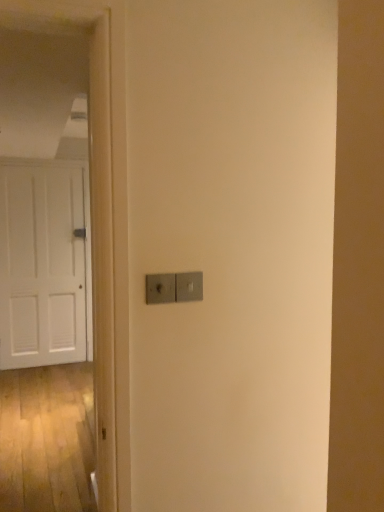
Find the location of a particular element. This screenshot has width=384, height=512. white matte door at left is located at coordinates (42, 265).

Do you think satin silver switch at center, which ranks as the first light switch in left-to-right order, is within satin silver switch at center, which appears as the first light switch when viewed from the right, or outside of it?

satin silver switch at center, which ranks as the first light switch in left-to-right order, is spatially situated outside satin silver switch at center, which appears as the first light switch when viewed from the right.

Is satin silver switch at center, the 2th light switch from the right, aimed at satin silver switch at center, which appears as the first light switch when viewed from the right?

No, satin silver switch at center, the 2th light switch from the right, does not turn towards satin silver switch at center, which appears as the first light switch when viewed from the right.

The image size is (384, 512). Find the location of `light switch on the right of satin silver switch at center, which ranks as the first light switch in left-to-right order`. light switch on the right of satin silver switch at center, which ranks as the first light switch in left-to-right order is located at coordinates (189, 286).

Is satin silver switch at center, the 2th light switch from the right, further to the viewer compared to satin silver switch at center, which is counted as the 2th light switch, starting from the left?

No, the depth of satin silver switch at center, the 2th light switch from the right, is less than that of satin silver switch at center, which is counted as the 2th light switch, starting from the left.

Is satin silver switch at center, which appears as the first light switch when viewed from the right, located within white matte door at left?

No, satin silver switch at center, which appears as the first light switch when viewed from the right, is not a part of white matte door at left.

Are white matte door at left and satin silver switch at center, which is counted as the 2th light switch, starting from the left, making contact?

white matte door at left is not next to satin silver switch at center, which is counted as the 2th light switch, starting from the left, and they're not touching.

Which of these two, white matte door at left or satin silver switch at center, which appears as the first light switch when viewed from the right, is wider?

white matte door at left.

Considering the sizes of objects white matte door at left and satin silver switch at center, which is counted as the 2th light switch, starting from the left, in the image provided, who is shorter, white matte door at left or satin silver switch at center, which is counted as the 2th light switch, starting from the left,?

Standing shorter between the two is satin silver switch at center, which is counted as the 2th light switch, starting from the left.

This screenshot has width=384, height=512. I want to click on door below the satin silver switch at center, which is counted as the 2th light switch, starting from the left (from the image's perspective), so click(42, 265).

Which is closer to the camera, (196, 300) or (77, 174)?

Point (196, 300) is positioned closer to the camera compared to point (77, 174).

Which object is positioned more to the left, satin silver switch at center, which appears as the first light switch when viewed from the right, or white matte door at left?

From the viewer's perspective, white matte door at left appears more on the left side.

Looking at this image, is satin silver switch at center, which appears as the first light switch when viewed from the right, aimed at white matte door at left?

No, satin silver switch at center, which appears as the first light switch when viewed from the right, is not aimed at white matte door at left.

From a real-world perspective, is satin silver switch at center, which ranks as the first light switch in left-to-right order, located higher than white matte door at left?

Yes.

Is satin silver switch at center, the 2th light switch from the right, with white matte door at left?

satin silver switch at center, the 2th light switch from the right, and white matte door at left are not in contact.

How many degrees apart are the facing directions of satin silver switch at center, the 2th light switch from the right, and white matte door at left?

The facing directions of satin silver switch at center, the 2th light switch from the right, and white matte door at left are 1.32 degrees apart.

Considering the relative sizes of satin silver switch at center, which ranks as the first light switch in left-to-right order, and white matte door at left in the image provided, is satin silver switch at center, which ranks as the first light switch in left-to-right order, wider than white matte door at left?

Yes.

From the image's perspective, is white matte door at left located above or below satin silver switch at center, the 2th light switch from the right?

From the image's perspective, white matte door at left appears below satin silver switch at center, the 2th light switch from the right.

Which is behind, point (45, 261) or point (152, 275)?

The point (45, 261) is farther from the camera.

Image resolution: width=384 pixels, height=512 pixels. I want to click on light switch that is the 2nd one when counting forward from the white matte door at left, so click(160, 288).

Consider the image. Is white matte door at left at the left side of satin silver switch at center, the 2th light switch from the right?

Indeed, white matte door at left is positioned on the left side of satin silver switch at center, the 2th light switch from the right.

From a real-world perspective, does satin silver switch at center, which appears as the first light switch when viewed from the right, sit lower than satin silver switch at center, the 2th light switch from the right?

Correct, in the physical world, satin silver switch at center, which appears as the first light switch when viewed from the right, is lower than satin silver switch at center, the 2th light switch from the right.

How far apart are satin silver switch at center, which appears as the first light switch when viewed from the right, and satin silver switch at center, the 2th light switch from the right?

satin silver switch at center, which appears as the first light switch when viewed from the right, and satin silver switch at center, the 2th light switch from the right, are 2.12 inches apart from each other.

Consider the image. Can you confirm if satin silver switch at center, which is counted as the 2th light switch, starting from the left, is taller than satin silver switch at center, which ranks as the first light switch in left-to-right order?

Correct, satin silver switch at center, which is counted as the 2th light switch, starting from the left, is much taller as satin silver switch at center, which ranks as the first light switch in left-to-right order.

Is point (185, 276) behind point (165, 287)?

That is True.

This screenshot has width=384, height=512. Find the location of `light switch lying above the satin silver switch at center, which is counted as the 2th light switch, starting from the left (from the image's perspective)`. light switch lying above the satin silver switch at center, which is counted as the 2th light switch, starting from the left (from the image's perspective) is located at coordinates (160, 288).

I want to click on door on the left of satin silver switch at center, which appears as the first light switch when viewed from the right, so click(42, 265).

Estimate the real-world distances between objects in this image. Which object is closer to satin silver switch at center, the 2th light switch from the right, satin silver switch at center, which appears as the first light switch when viewed from the right, or white matte door at left?

satin silver switch at center, which appears as the first light switch when viewed from the right, is positioned closer to the anchor satin silver switch at center, the 2th light switch from the right.

Estimate the real-world distances between objects in this image. Which object is further from white matte door at left, satin silver switch at center, the 2th light switch from the right, or satin silver switch at center, which is counted as the 2th light switch, starting from the left?

Among the two, satin silver switch at center, which is counted as the 2th light switch, starting from the left, is located further to white matte door at left.

Based on their spatial positions, is satin silver switch at center, which appears as the first light switch when viewed from the right, or satin silver switch at center, the 2th light switch from the right, closer to white matte door at left?

satin silver switch at center, the 2th light switch from the right, lies closer to white matte door at left than the other object.

Based on their spatial positions, is white matte door at left or satin silver switch at center, which appears as the first light switch when viewed from the right, further from satin silver switch at center, the 2th light switch from the right?

white matte door at left is further to satin silver switch at center, the 2th light switch from the right.

Looking at the image, which one is located closer to satin silver switch at center, which is counted as the 2th light switch, starting from the left, white matte door at left or satin silver switch at center, which ranks as the first light switch in left-to-right order?

satin silver switch at center, which ranks as the first light switch in left-to-right order.

Which object lies nearer to the anchor point satin silver switch at center, which appears as the first light switch when viewed from the right, satin silver switch at center, which ranks as the first light switch in left-to-right order, or white matte door at left?

Based on the image, satin silver switch at center, which ranks as the first light switch in left-to-right order, appears to be nearer to satin silver switch at center, which appears as the first light switch when viewed from the right.

This screenshot has height=512, width=384. What are the coordinates of `light switch between satin silver switch at center, which ranks as the first light switch in left-to-right order, and white matte door at left from front to back` in the screenshot? It's located at (189, 286).